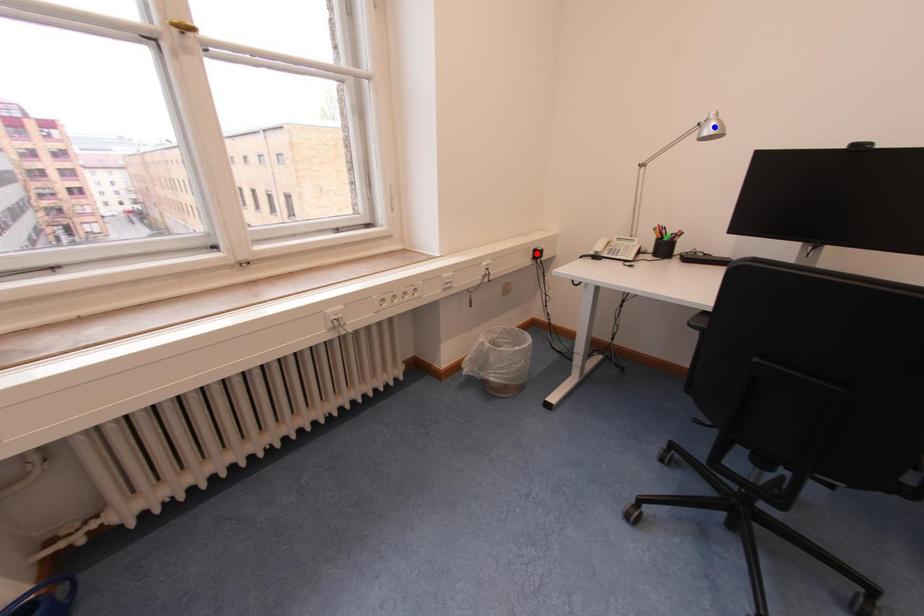
Question: Which of the two points in the image is closer to the camera?

Choices:
 (A) Blue point is closer.
 (B) Red point is closer.

Answer: (A)